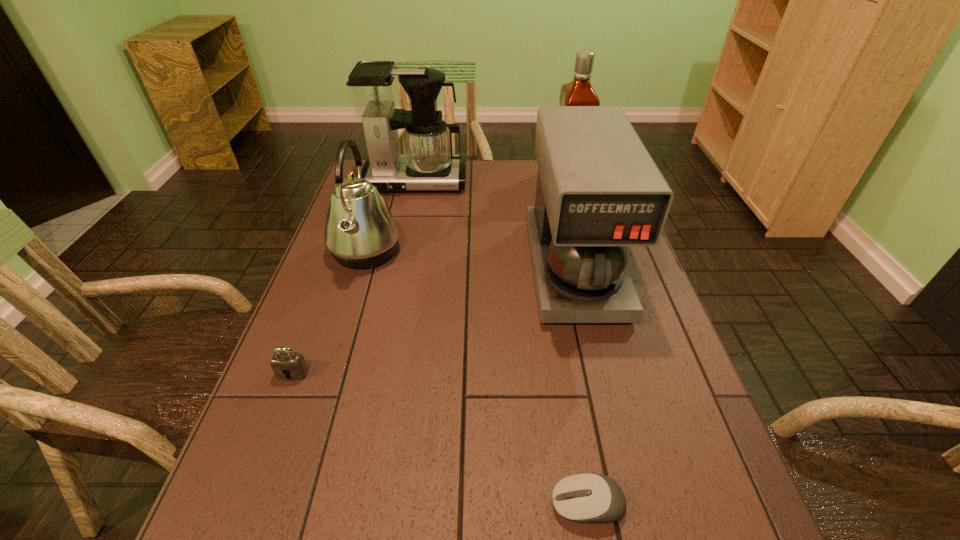
Identify the location of vacant area that lies between the right coffee maker and the padlock. The height and width of the screenshot is (540, 960). (434, 320).

This screenshot has width=960, height=540. Find the location of `blank region between the kettle and the liquor`. blank region between the kettle and the liquor is located at coordinates (467, 215).

The width and height of the screenshot is (960, 540). Find the location of `vacant area that lies between the farther coffee maker and the computer equipment`. vacant area that lies between the farther coffee maker and the computer equipment is located at coordinates coord(501,343).

Where is `free spot between the kettle and the fifth farthest object`? The height and width of the screenshot is (540, 960). free spot between the kettle and the fifth farthest object is located at coordinates (329, 313).

Locate an element on the screen. This screenshot has width=960, height=540. free space that is in between the fifth farthest object and the farther coffee maker is located at coordinates (354, 278).

Where is `free area in between the farther coffee maker and the liquor`? The image size is (960, 540). free area in between the farther coffee maker and the liquor is located at coordinates (492, 180).

You are a GUI agent. You are given a task and a screenshot of the screen. Output one action in this format:
    pyautogui.click(x=<x>, y=<y>)
    Task: Click on the empty space between the liquor and the computer equipment
    This screenshot has height=540, width=960.
    Given the screenshot: What is the action you would take?
    pyautogui.click(x=578, y=342)

Where is `vacant area that lies between the farther coffee maker and the shortest object`? This screenshot has width=960, height=540. vacant area that lies between the farther coffee maker and the shortest object is located at coordinates (501, 343).

Locate an element on the screen. The height and width of the screenshot is (540, 960). empty location between the computer equipment and the fifth farthest object is located at coordinates (441, 439).

Identify the location of object that is the closest one to the left coffee maker. (360, 231).